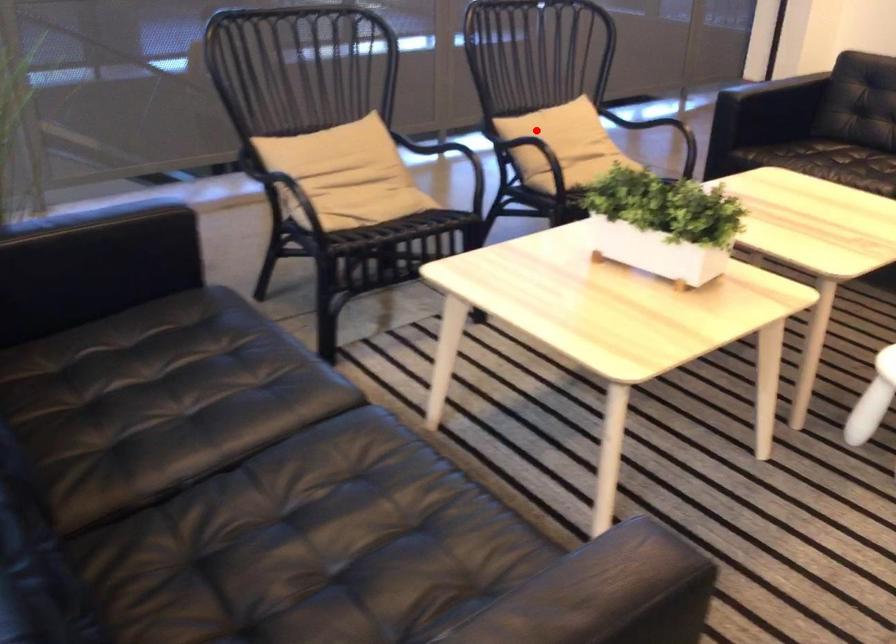
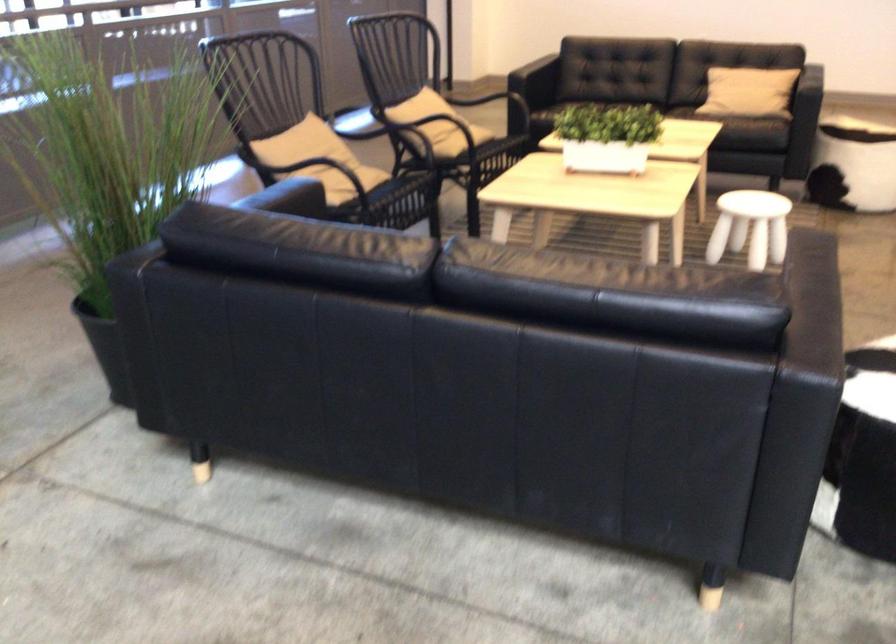
Question: I am providing you with two images of the same scene from different viewpoints. In image1, a red point is highlighted. Considering the same 3D point in image2, which of the following is correct?

Choices:
 (A) It is closer
 (B) It is farther

Answer: (B)